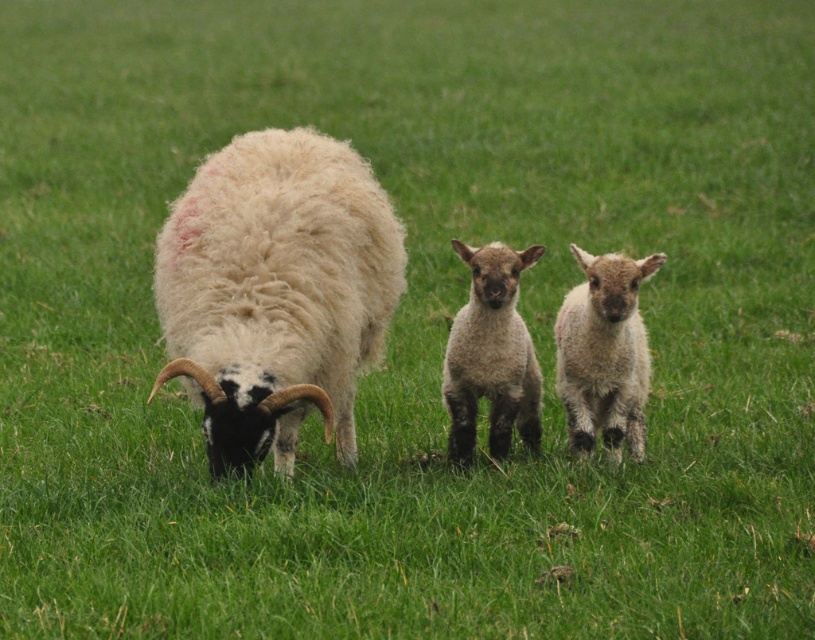
You are a farmer checking the size of the lambs in the field. Which lamb is smaller between the fuzzy white lamb at center and the light brown woolly lamb at center?

The fuzzy white lamb at center is smaller than the light brown woolly lamb at center.